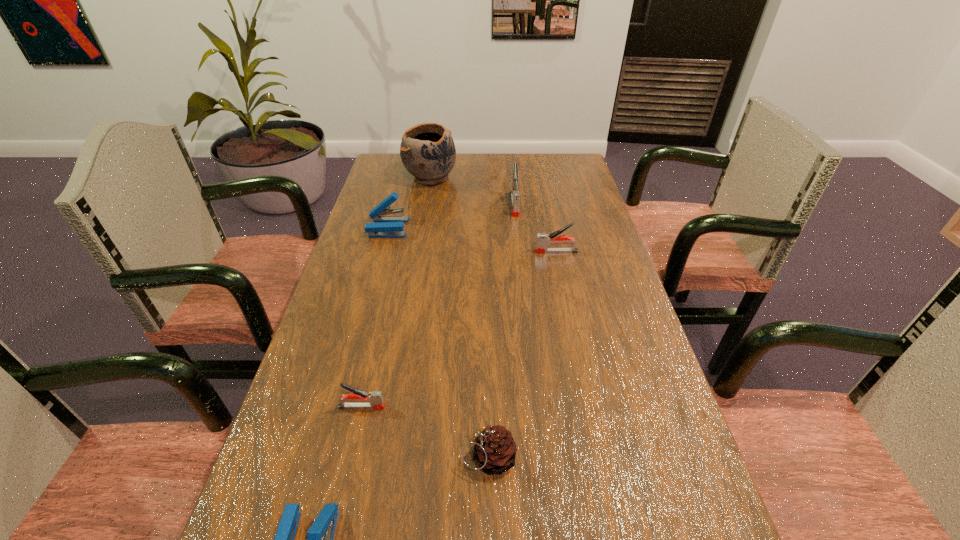
Identify the location of vacant point located with a leaf charm attached to the pinecone. (324, 457).

You are a GUI agent. You are given a task and a screenshot of the screen. Output one action in this format:
    pyautogui.click(x=<x>, y=<y>)
    Task: Click on the vacant space located on the handle side of the second nearest stapler
    This screenshot has width=960, height=540.
    Given the screenshot: What is the action you would take?
    pyautogui.click(x=540, y=407)

Locate an element on the screen. The image size is (960, 540). object positioned at the far edge is located at coordinates (427, 151).

Locate an element on the screen. pottery at the left edge is located at coordinates (427, 151).

The width and height of the screenshot is (960, 540). I want to click on object present at the right edge, so click(543, 240).

What are the coordinates of `object present at the far left corner` in the screenshot? It's located at (427, 151).

In the image, there is a desktop. Identify the location of free space at the far edge. (481, 157).

The width and height of the screenshot is (960, 540). What are the coordinates of `vacant area at the left edge` in the screenshot? It's located at (377, 204).

This screenshot has height=540, width=960. In the image, there is a desktop. In order to click on vacant space at the right edge in this screenshot , I will do `click(561, 215)`.

In the image, there is a desktop. Find the location of `vacant space at the far right corner`. vacant space at the far right corner is located at coordinates (574, 166).